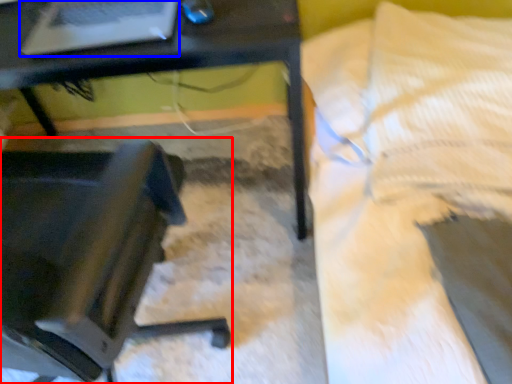
Question: Which object appears farthest to the camera in this image, chair (highlighted by a red box) or laptop (highlighted by a blue box)?

Choices:
 (A) chair
 (B) laptop

Answer: (A)